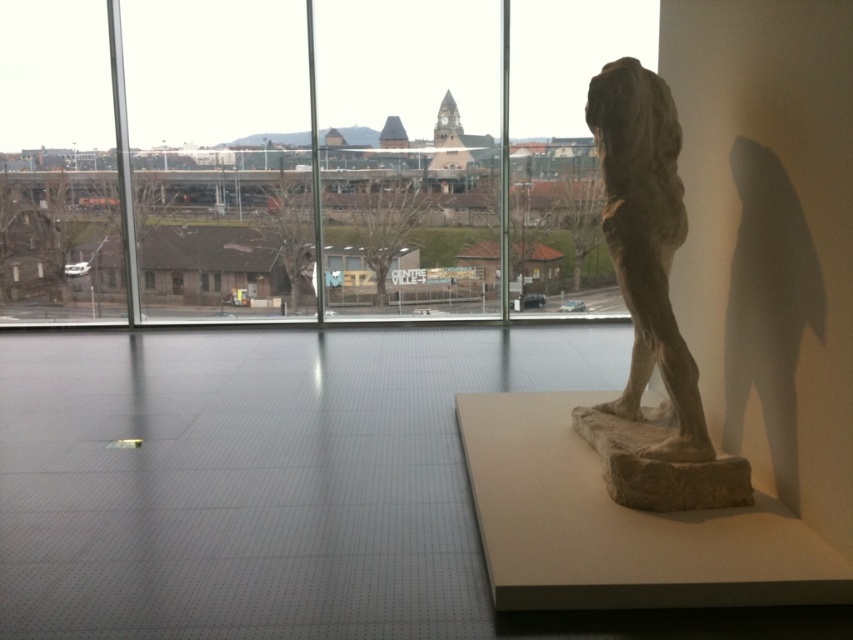
Question: Does transparent glass window at center lie behind stone statue at right?

Choices:
 (A) no
 (B) yes

Answer: (B)

Question: Can you confirm if transparent glass window at center is wider than stone statue at right?

Choices:
 (A) no
 (B) yes

Answer: (B)

Question: Which object is farther from the camera taking this photo?

Choices:
 (A) transparent glass window at center
 (B) stone statue at right

Answer: (A)

Question: Which point appears farthest from the camera in this image?

Choices:
 (A) (711, 445)
 (B) (105, 262)

Answer: (B)

Question: Considering the relative positions of transparent glass window at center and stone statue at right in the image provided, where is transparent glass window at center located with respect to stone statue at right?

Choices:
 (A) right
 (B) left

Answer: (B)

Question: Which point appears closest to the camera in this image?

Choices:
 (A) (619, 202)
 (B) (523, 257)

Answer: (A)